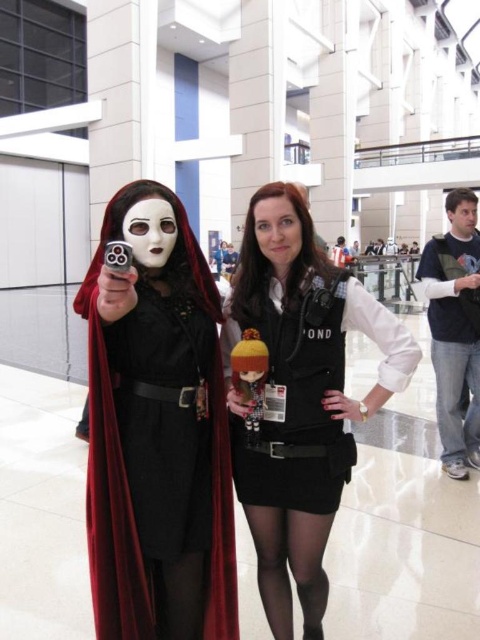
Question: Is the position of matte black vest at center less distant than that of navy blue fleece at right?

Choices:
 (A) no
 (B) yes

Answer: (B)

Question: Which object is the closest to the velvet black cape at center?

Choices:
 (A) matte black vest at center
 (B) navy blue fleece at right

Answer: (A)

Question: Among these objects, which one is nearest to the camera?

Choices:
 (A) navy blue fleece at right
 (B) matte black vest at center
 (C) velvet black cape at center

Answer: (C)

Question: Considering the relative positions of velvet black cape at center and navy blue fleece at right in the image provided, where is velvet black cape at center located with respect to navy blue fleece at right?

Choices:
 (A) above
 (B) below

Answer: (B)

Question: Which of the following is the farthest from the observer?

Choices:
 (A) matte black vest at center
 (B) velvet black cape at center
 (C) navy blue fleece at right

Answer: (C)

Question: Is velvet black cape at center to the right of matte black vest at center from the viewer's perspective?

Choices:
 (A) no
 (B) yes

Answer: (A)